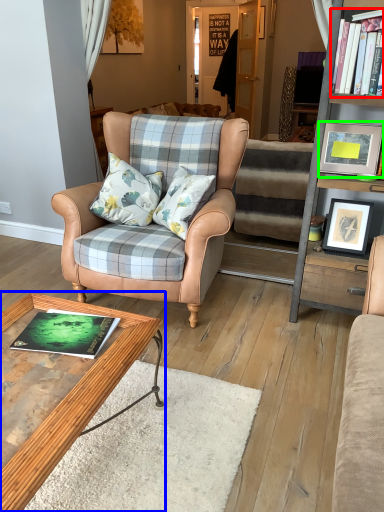
Question: Estimate the real-world distances between objects in this image. Which object is closer to book (highlighted by a red box), coffee table (highlighted by a blue box) or picture frame (highlighted by a green box)?

Choices:
 (A) coffee table
 (B) picture frame

Answer: (B)